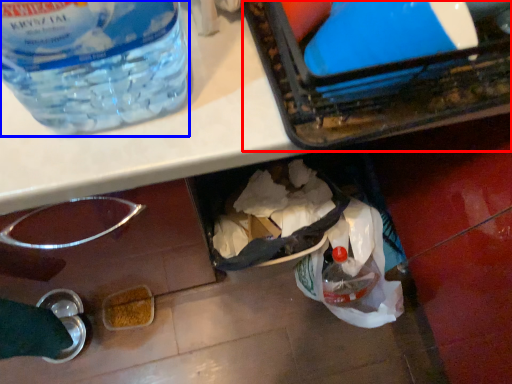
Question: Which object appears farthest to the camera in this image, box (highlighted by a red box) or bottle (highlighted by a blue box)?

Choices:
 (A) box
 (B) bottle

Answer: (A)